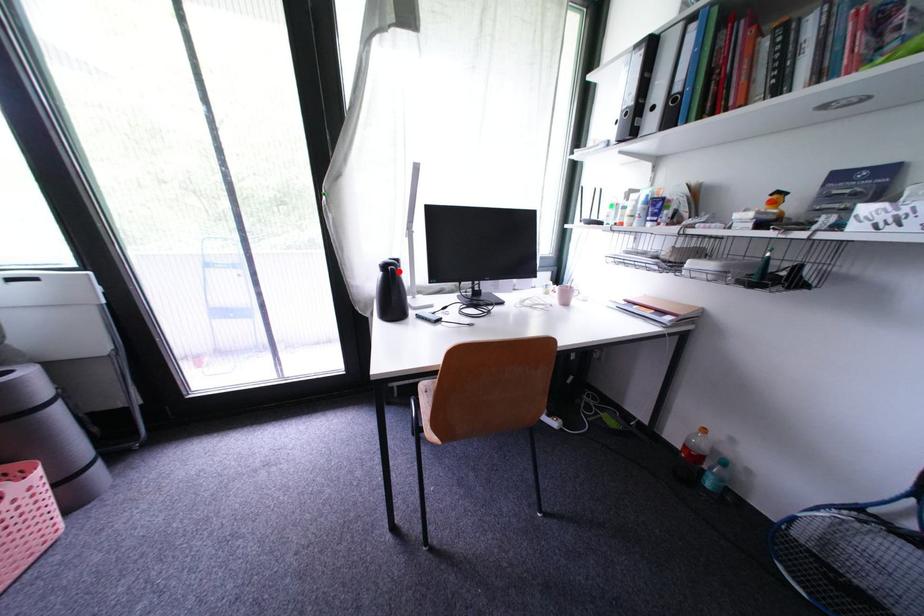
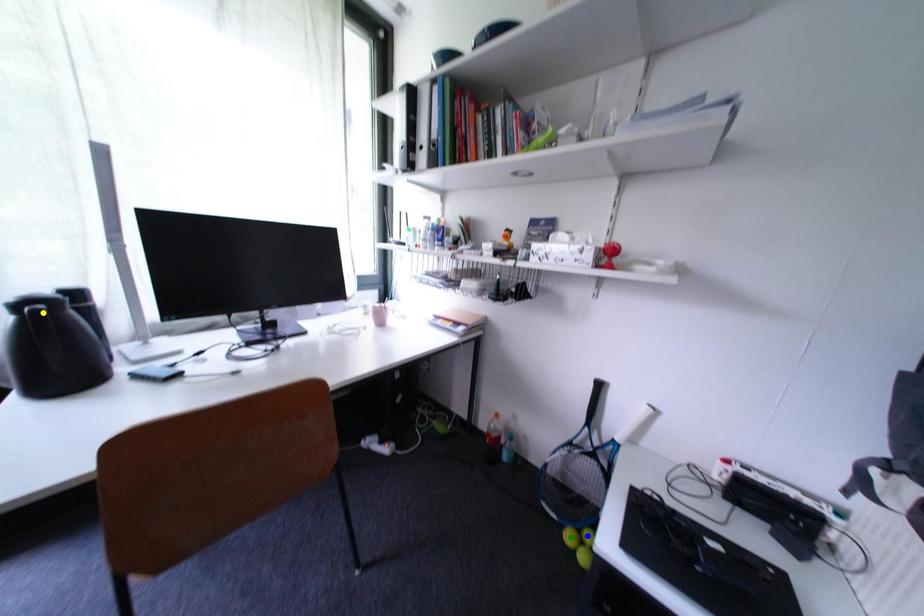
Question: I am providing you with two images of the same scene from different viewpoints. A red point is marked on the first image. You are given multiple points on the second image. In image 2, which mark is for the same physical point as the one in image 1?

Choices:
 (A) yellow point
 (B) blue point
 (C) green point

Answer: (A)